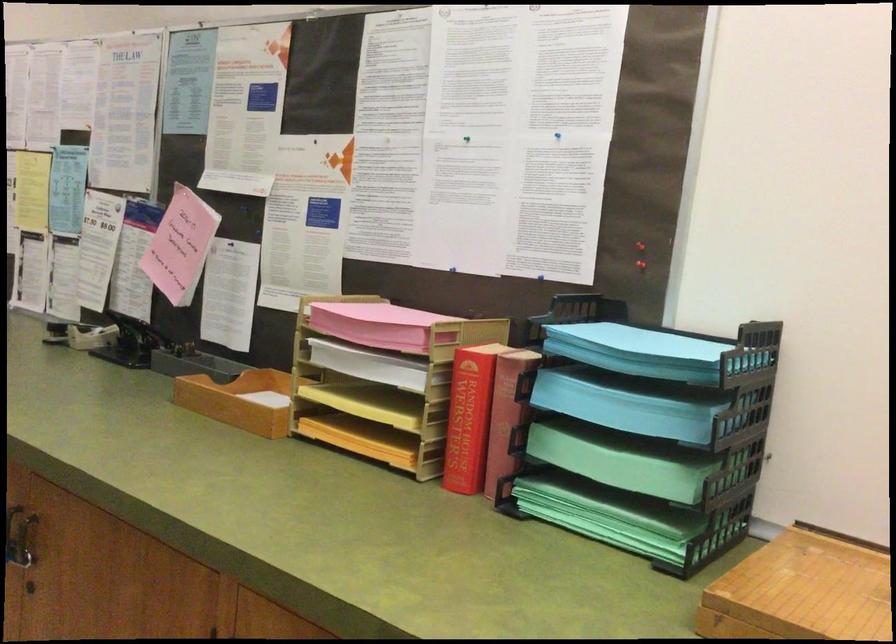
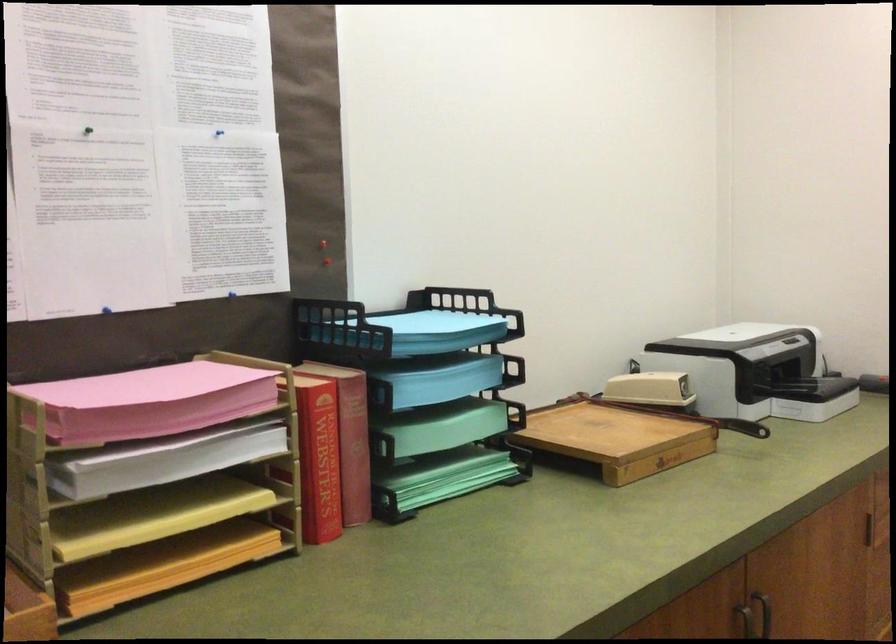
The point at (x=462, y=410) is marked in the first image. Where is the corresponding point in the second image?

(319, 456)